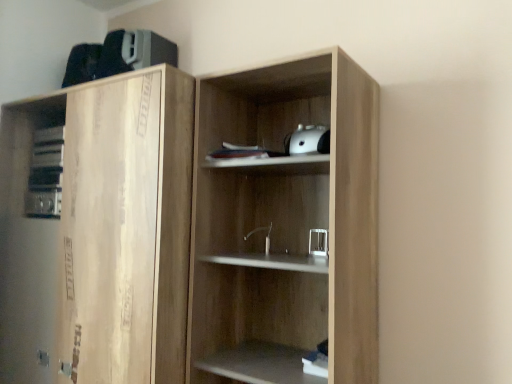
Question: Based on their sizes in the image, would you say natural wood cabinet at left is bigger or smaller than wooden cupboard at center?

Choices:
 (A) small
 (B) big

Answer: (B)

Question: Does point (38, 291) appear closer or farther from the camera than point (332, 364)?

Choices:
 (A) closer
 (B) farther

Answer: (B)

Question: Relative to wooden cupboard at center, is natural wood cabinet at left in front or behind?

Choices:
 (A) front
 (B) behind

Answer: (B)

Question: Visually, is wooden cupboard at center positioned to the left or to the right of natural wood cabinet at left?

Choices:
 (A) right
 (B) left

Answer: (A)

Question: From a real-world perspective, relative to natural wood cabinet at left, is wooden cupboard at center vertically above or below?

Choices:
 (A) above
 (B) below

Answer: (A)

Question: Relative to natural wood cabinet at left, is wooden cupboard at center in front or behind?

Choices:
 (A) front
 (B) behind

Answer: (A)

Question: From the image's perspective, is wooden cupboard at center positioned above or below natural wood cabinet at left?

Choices:
 (A) below
 (B) above

Answer: (B)